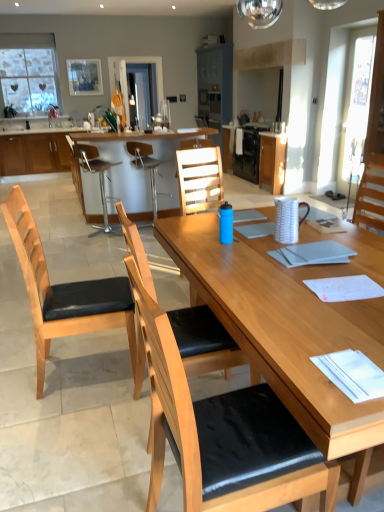
Identify the location of free area below light wood chair with black cushion at left, placed as the 3th chair when sorted from back to front (from a real-world perspective). (87, 369).